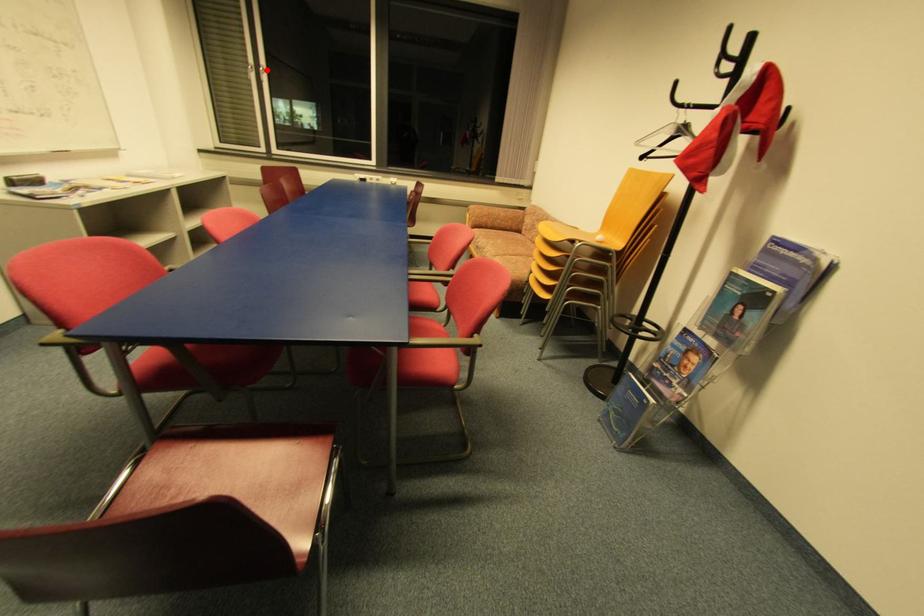
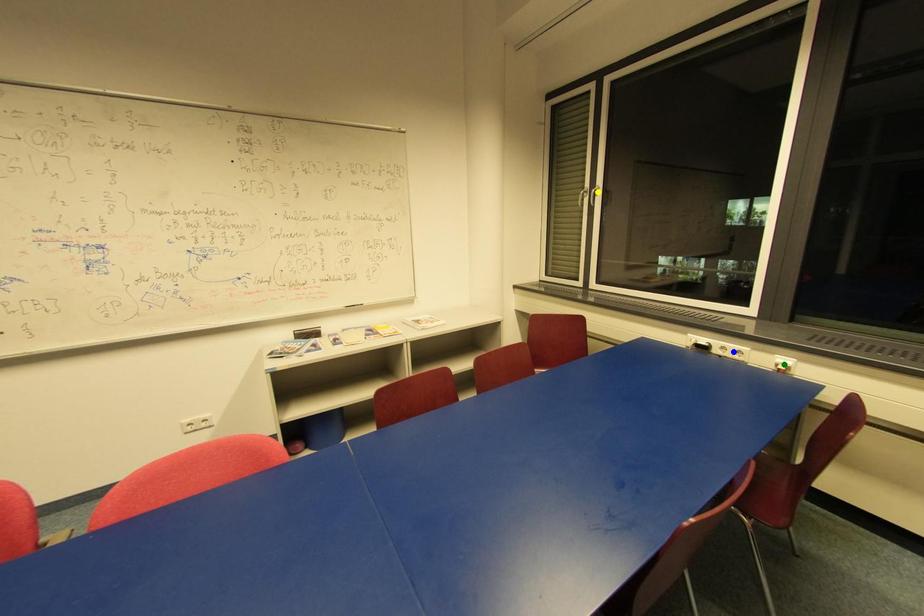
Question: I am providing you with two images of the same scene from different viewpoints. A red point is marked on the first image. You are given multiple points on the second image. Can you choose the point in image 2 that corresponds to the point in image 1?

Choices:
 (A) green point
 (B) yellow point
 (C) blue point

Answer: (B)